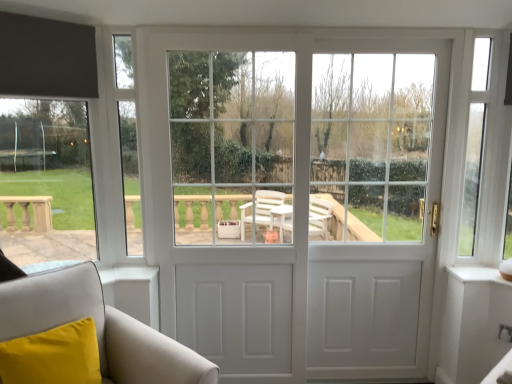
Find the location of a particular element. This screenshot has height=384, width=512. blank space situated above white glossy door at right, which is the 1th screen door from right to left (from a real-world perspective) is located at coordinates click(390, 36).